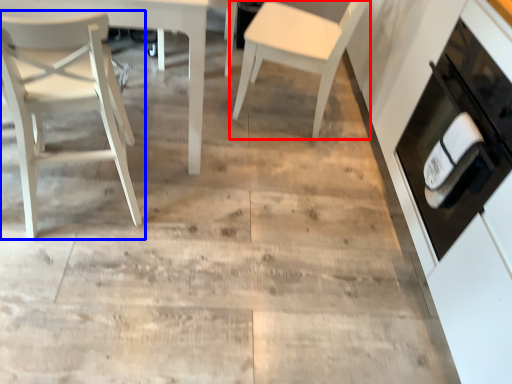
Question: Which of the following is the closest to the observer, chair (highlighted by a red box) or chair (highlighted by a blue box)?

Choices:
 (A) chair
 (B) chair

Answer: (B)